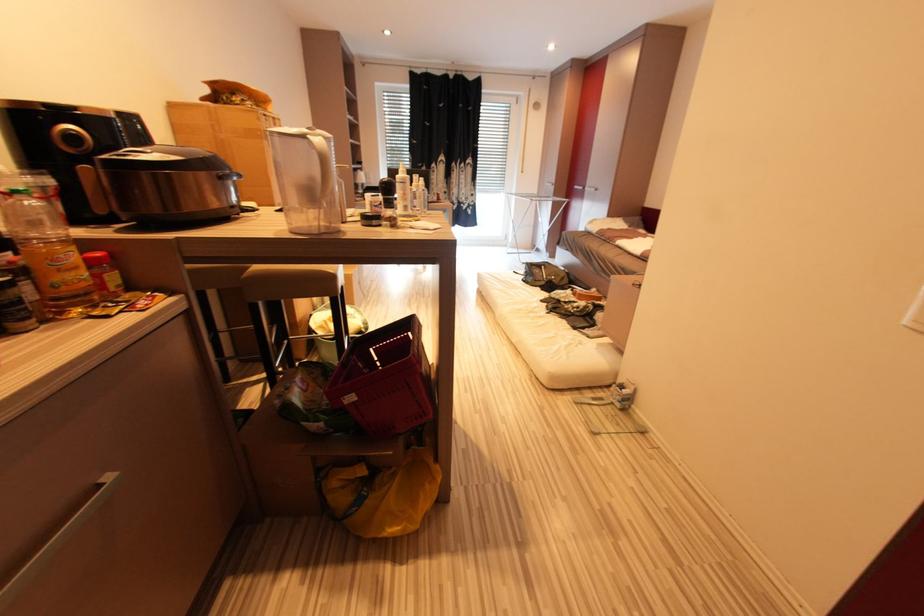
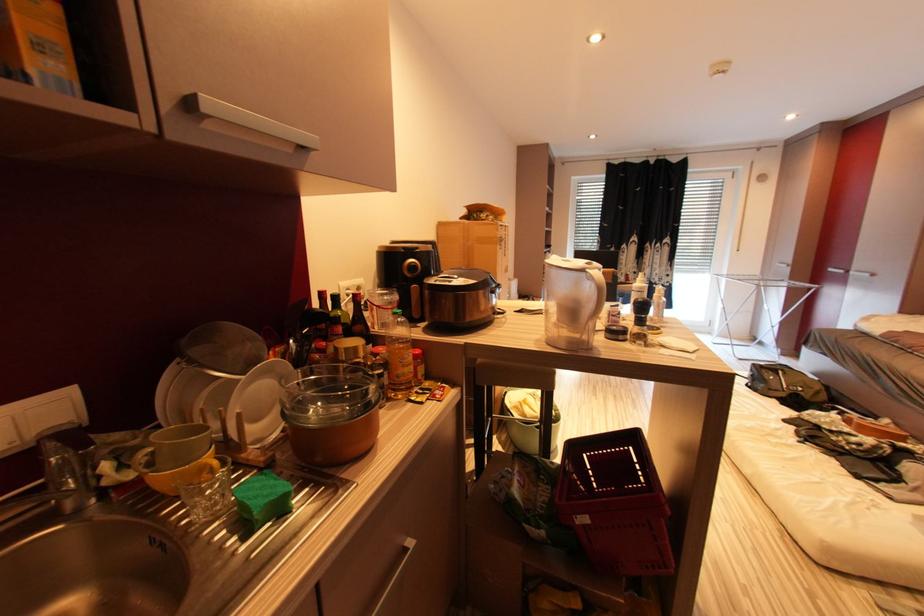
In a continuous first-person perspective shot, in which direction is the camera moving?

The movement direction of the cameraman is left, backward.